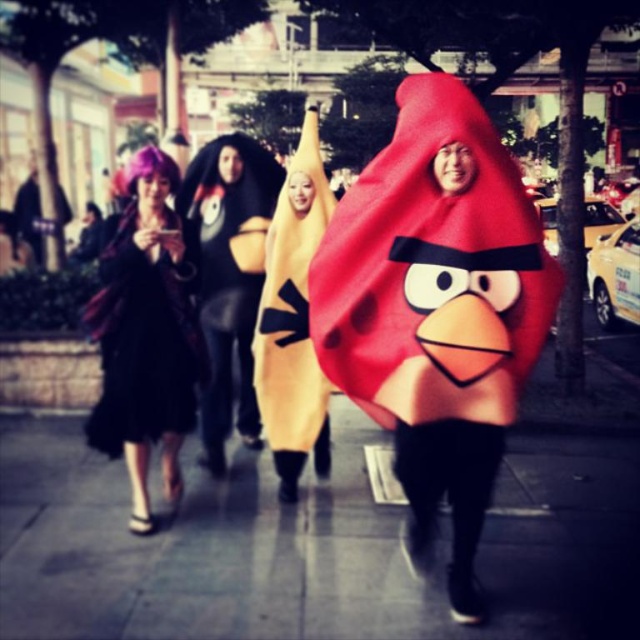
You are a delivery drone flying above the street scene. You need to land on the smooth concrete pavement at center. However, there is a matte red costume at center in the way. Can you land safely on the pavement without hitting the costume?

The smooth concrete pavement at center is located below the matte red costume at center, so the drone can land safely on the pavement as it is positioned under the costume.

You are a photographer standing at the origin point of the coordinate system. You want to take a photo of the matte red costume at center. What are the coordinates where you should aim your camera?

The coordinates where you should aim your camera are at point (435, 308), as that is the position of the matte red costume at center.

Based on the photo, you are standing at the point marked as point (602, 486) in the image. You want to take a photo of the person in the red costume from the front. Is the distance between you and the person in the red costume sufficient to capture them clearly in your camera, considering the camera has a maximum focus range of 15 feet?

The distance between you and the person in the red costume is 14.65 feet, which is within the camera maximum focus range of 15 feet. Therefore, you can capture them clearly.